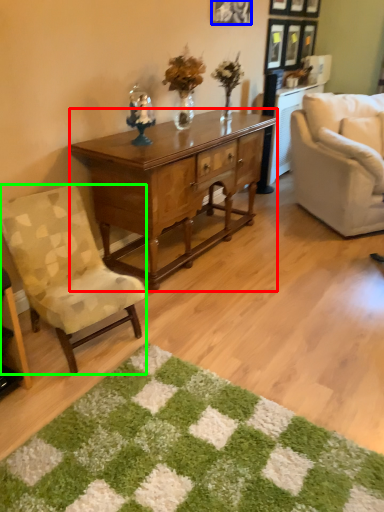
Question: Considering the real-world distances, which object is closest to desk (highlighted by a red box)? picture frame (highlighted by a blue box) or chair (highlighted by a green box).

Choices:
 (A) picture frame
 (B) chair

Answer: (B)